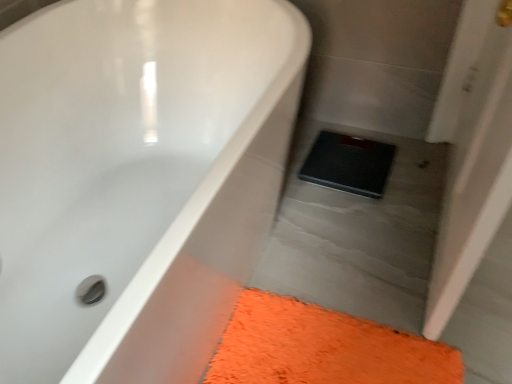
This screenshot has width=512, height=384. I want to click on space that is in front of black rubber scale at center, so click(x=361, y=223).